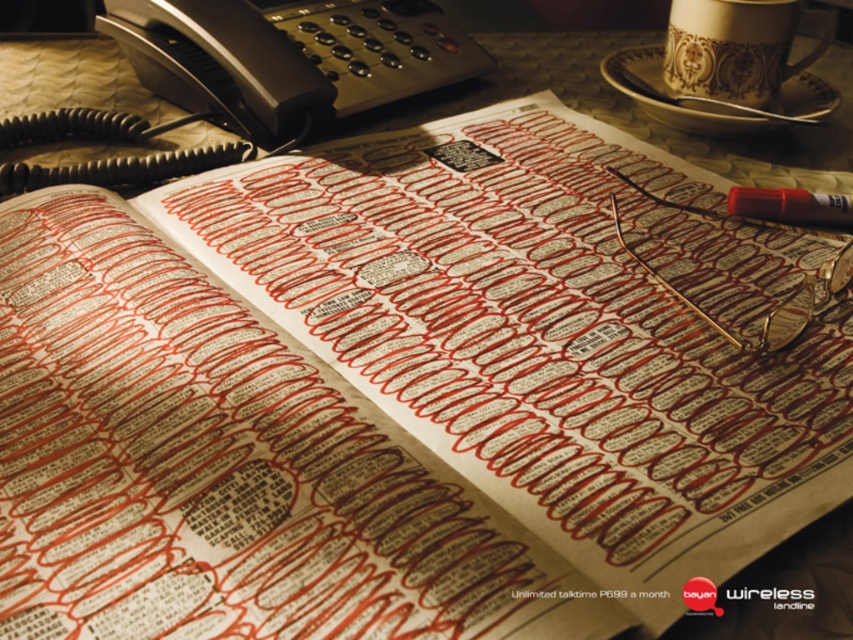
Is gold textured coffee cup at upper right below translucent red pen at upper right?

Incorrect, gold textured coffee cup at upper right is not positioned below translucent red pen at upper right.

Is gold textured coffee cup at upper right to the left of translucent red pen at upper right from the viewer's perspective?

No, gold textured coffee cup at upper right is not to the left of translucent red pen at upper right.

Find the location of `gold textured coffee cup at upper right`. gold textured coffee cup at upper right is located at coordinates click(735, 49).

The image size is (853, 640). Identify the location of gold textured coffee cup at upper right. (735, 49).

Is black plastic phone at upper left to the right of gold textured coffee cup at upper right from the viewer's perspective?

No, black plastic phone at upper left is not to the right of gold textured coffee cup at upper right.

Who is higher up, black plastic phone at upper left or gold textured coffee cup at upper right?

black plastic phone at upper left is higher up.

At what (x,y) coordinates should I click in order to perform the action: click on black plastic phone at upper left. Please return your answer as a coordinate pair (x, y). This screenshot has height=640, width=853. Looking at the image, I should click on (289, 54).

Does black plastic phone at upper left have a larger size compared to translucent red pen at upper right?

Correct, black plastic phone at upper left is larger in size than translucent red pen at upper right.

Locate an element on the screen. black plastic phone at upper left is located at coordinates (289, 54).

Which is behind, point (281, 84) or point (824, 204)?

Positioned behind is point (281, 84).

You are a GUI agent. You are given a task and a screenshot of the screen. Output one action in this format:
    pyautogui.click(x=<x>, y=<y>)
    Task: Click on the black plastic phone at upper left
    
    Given the screenshot: What is the action you would take?
    pyautogui.click(x=289, y=54)